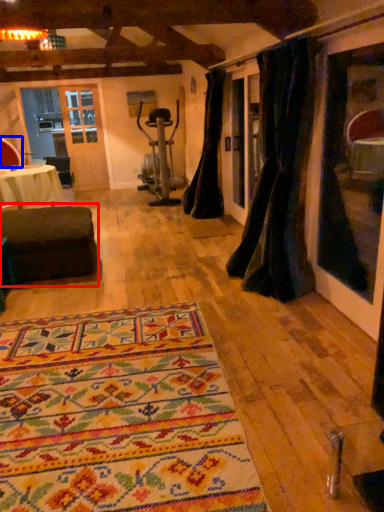
Question: Which of the following is the farthest to the observer, studio couch (highlighted by a red box) or armchair (highlighted by a blue box)?

Choices:
 (A) studio couch
 (B) armchair

Answer: (B)